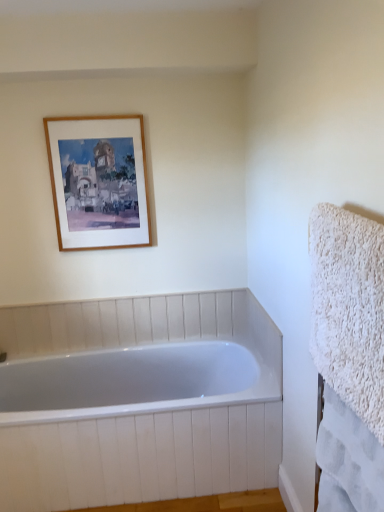
Question: Is wooden frame at upper left oriented away from white fluffy towel at right, placed as the first bath towel when sorted from top to bottom?

Choices:
 (A) no
 (B) yes

Answer: (A)

Question: Considering the relative positions of wooden frame at upper left and white fluffy towel at right, the second bath towel positioned from the bottom, in the image provided, is wooden frame at upper left to the left of white fluffy towel at right, the second bath towel positioned from the bottom, from the viewer's perspective?

Choices:
 (A) no
 (B) yes

Answer: (B)

Question: Is wooden frame at upper left surrounding white fluffy towel at right, placed as the first bath towel when sorted from top to bottom?

Choices:
 (A) no
 (B) yes

Answer: (A)

Question: Could you tell me if wooden frame at upper left is facing white fluffy towel at right, the second bath towel positioned from the bottom?

Choices:
 (A) yes
 (B) no

Answer: (A)

Question: From the image's perspective, is wooden frame at upper left under white fluffy towel at right, the second bath towel positioned from the bottom?

Choices:
 (A) no
 (B) yes

Answer: (A)

Question: Is wooden frame at upper left outside white fluffy towel at right, the second bath towel positioned from the bottom?

Choices:
 (A) yes
 (B) no

Answer: (A)

Question: From the image's perspective, is white fluffy towel at right, placed as the first bath towel when sorted from top to bottom, on top of white fluffy towel at right, the second bath towel when ordered from top to bottom?

Choices:
 (A) yes
 (B) no

Answer: (A)

Question: Is white fluffy towel at right, marked as the 1th bath towel in a bottom-to-top arrangement, at the back of white fluffy towel at right, the second bath towel positioned from the bottom?

Choices:
 (A) no
 (B) yes

Answer: (A)

Question: Is white fluffy towel at right, the second bath towel positioned from the bottom, not within white fluffy towel at right, the second bath towel when ordered from top to bottom?

Choices:
 (A) yes
 (B) no

Answer: (A)

Question: Does white fluffy towel at right, the second bath towel positioned from the bottom, appear on the right side of white fluffy towel at right, marked as the 1th bath towel in a bottom-to-top arrangement?

Choices:
 (A) yes
 (B) no

Answer: (B)

Question: Is white fluffy towel at right, placed as the first bath towel when sorted from top to bottom, behind white fluffy towel at right, marked as the 1th bath towel in a bottom-to-top arrangement?

Choices:
 (A) yes
 (B) no

Answer: (B)

Question: Is white fluffy towel at right, the second bath towel positioned from the bottom, oriented towards white fluffy towel at right, the second bath towel when ordered from top to bottom?

Choices:
 (A) yes
 (B) no

Answer: (B)

Question: Is the depth of white fluffy towel at right, marked as the 1th bath towel in a bottom-to-top arrangement, greater than that of wooden frame at upper left?

Choices:
 (A) no
 (B) yes

Answer: (A)